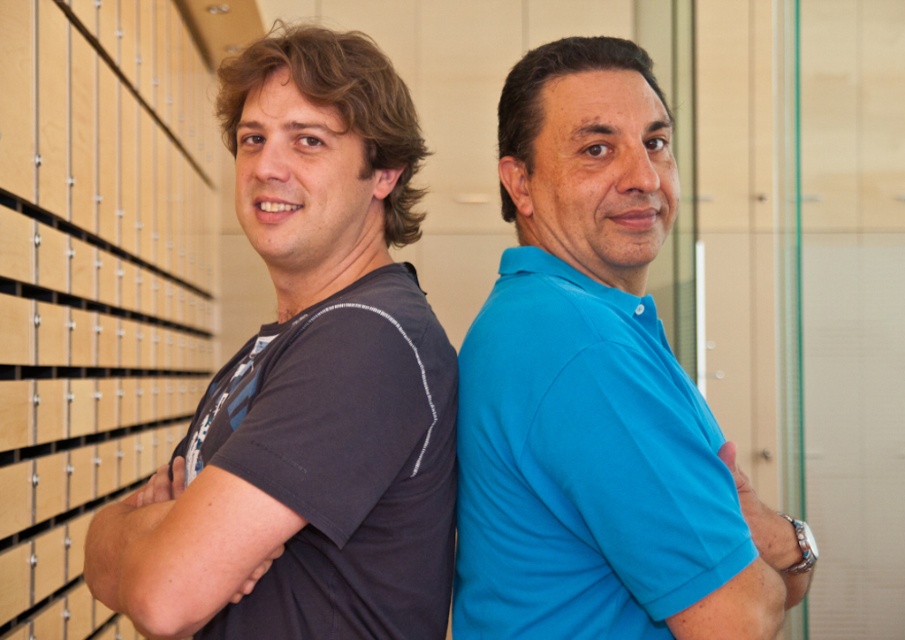
You are a tailor measuring two items in the image. The first is the blue smooth polo shirt at center, and the second is the metallic silver watch at right. Which item is wider?

The blue smooth polo shirt at center is wider than the metallic silver watch at right.